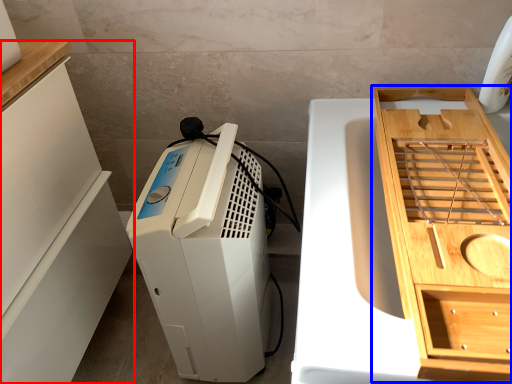
Question: Among these objects, which one is farthest to the camera, cabinetry (highlighted by a red box) or cabinetry (highlighted by a blue box)?

Choices:
 (A) cabinetry
 (B) cabinetry

Answer: (A)